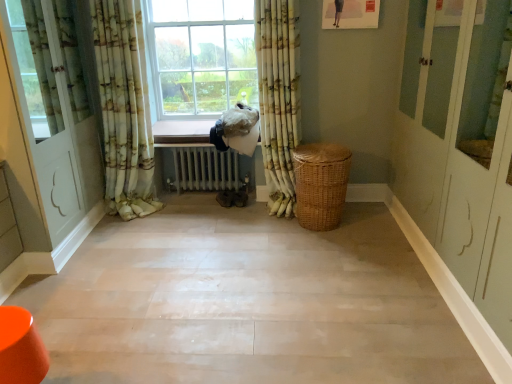
Question: Can you confirm if woven brown basket at center-right is bigger than white glossy door at left?

Choices:
 (A) no
 (B) yes

Answer: (A)

Question: Is woven brown basket at center-right outside white glossy door at left?

Choices:
 (A) yes
 (B) no

Answer: (A)

Question: Is there a large distance between woven brown basket at center-right and white glossy door at left?

Choices:
 (A) yes
 (B) no

Answer: (A)

Question: Can you confirm if woven brown basket at center-right is positioned to the left of white glossy door at left?

Choices:
 (A) no
 (B) yes

Answer: (A)

Question: Does woven brown basket at center-right have a lesser width compared to white glossy door at left?

Choices:
 (A) yes
 (B) no

Answer: (A)

Question: Can you confirm if woven brown basket at center-right is wider than white glossy door at left?

Choices:
 (A) yes
 (B) no

Answer: (B)

Question: Is smooth beige floor at center smaller than floral fabric curtain at left, which appears as the 2th curtain when viewed from the right?

Choices:
 (A) no
 (B) yes

Answer: (A)

Question: From the image's perspective, is smooth beige floor at center on top of floral fabric curtain at left, which appears as the 2th curtain when viewed from the right?

Choices:
 (A) yes
 (B) no

Answer: (B)

Question: From a real-world perspective, is smooth beige floor at center over floral fabric curtain at left, which appears as the 2th curtain when viewed from the right?

Choices:
 (A) no
 (B) yes

Answer: (A)

Question: Is smooth beige floor at center facing away from floral fabric curtain at left, which appears as the 2th curtain when viewed from the right?

Choices:
 (A) no
 (B) yes

Answer: (A)

Question: Would you say smooth beige floor at center is outside floral fabric curtain at left, which appears as the 2th curtain when viewed from the right?

Choices:
 (A) yes
 (B) no

Answer: (A)

Question: From the image's perspective, is smooth beige floor at center below floral fabric curtain at left, which ranks as the first curtain in left-to-right order?

Choices:
 (A) yes
 (B) no

Answer: (A)

Question: Is floral fabric curtain at left, which ranks as the first curtain in left-to-right order, to the right of metallic radiator at center from the viewer's perspective?

Choices:
 (A) yes
 (B) no

Answer: (B)